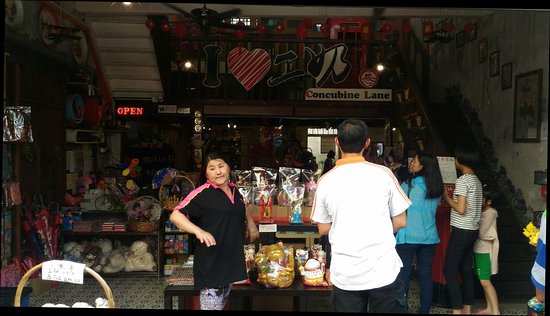
Where is `artwork`? This screenshot has height=316, width=550. artwork is located at coordinates (533, 120), (507, 69).